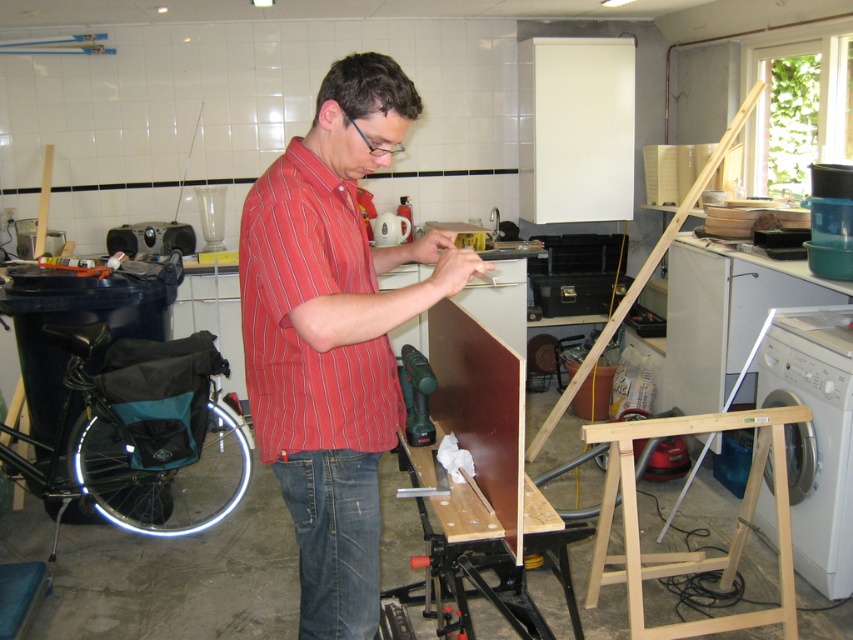
Question: Can you confirm if red striped shirt at center is smaller than green plastic drill at center?

Choices:
 (A) no
 (B) yes

Answer: (A)

Question: Among these points, which one is nearest to the camera?

Choices:
 (A) (405, 433)
 (B) (317, 516)
 (C) (241, 476)
 (D) (317, 552)

Answer: (B)

Question: Which object is farther from the camera taking this photo?

Choices:
 (A) red striped shirt at center
 (B) teal fabric bicycle wheel at lower left

Answer: (B)

Question: Can you confirm if red striped shirt at center is wider than denim jeans at lower center?

Choices:
 (A) yes
 (B) no

Answer: (A)

Question: Can you confirm if red striped shirt at center is smaller than teal fabric bicycle wheel at lower left?

Choices:
 (A) yes
 (B) no

Answer: (A)

Question: Which point is farther to the camera?

Choices:
 (A) denim jeans at lower center
 (B) teal fabric bicycle wheel at lower left

Answer: (B)